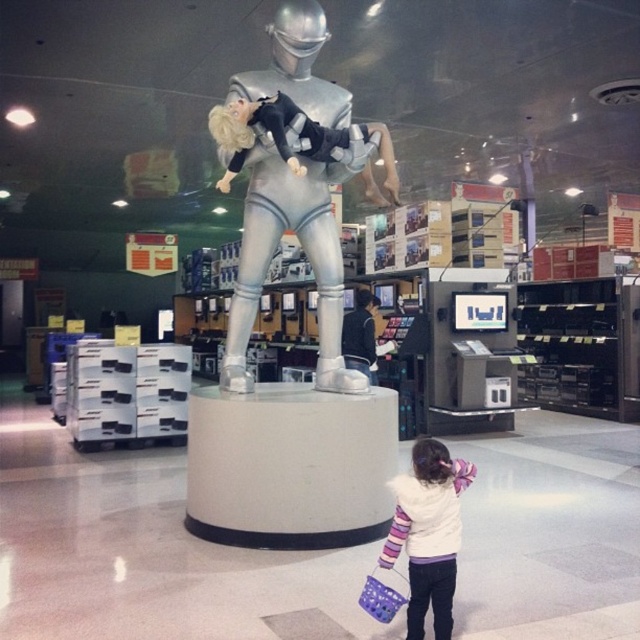
Question: Which point is closer to the camera?

Choices:
 (A) click(x=339, y=307)
 (B) click(x=401, y=484)
 (C) click(x=381, y=598)

Answer: (C)

Question: Does silver metallic statue at center appear under white fleece jacket at lower right?

Choices:
 (A) yes
 (B) no

Answer: (B)

Question: Which object is positioned farthest from the silver metallic statue at center?

Choices:
 (A) white fleece jacket at lower right
 (B) plastic purple shopping basket at lower right

Answer: (B)

Question: Is silver metallic statue at center above plastic purple shopping basket at lower right?

Choices:
 (A) no
 (B) yes

Answer: (B)

Question: Which of these objects is positioned farthest from the plastic purple shopping basket at lower right?

Choices:
 (A) white fleece jacket at lower right
 (B) silver metallic statue at center

Answer: (B)

Question: Does silver metallic statue at center have a greater width compared to white fleece jacket at lower right?

Choices:
 (A) no
 (B) yes

Answer: (B)